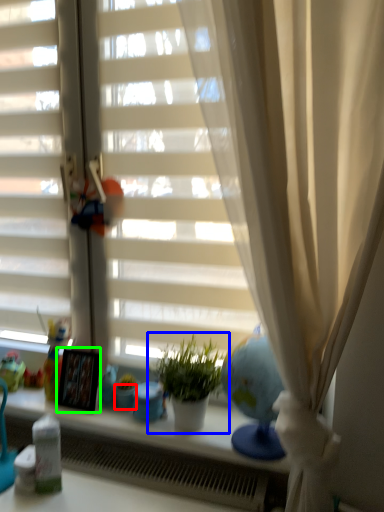
Question: Which object is the farthest from glass vase (highlighted by a red box)? Choose among these: houseplant (highlighted by a blue box) or picture frame (highlighted by a green box).

Choices:
 (A) houseplant
 (B) picture frame

Answer: (A)